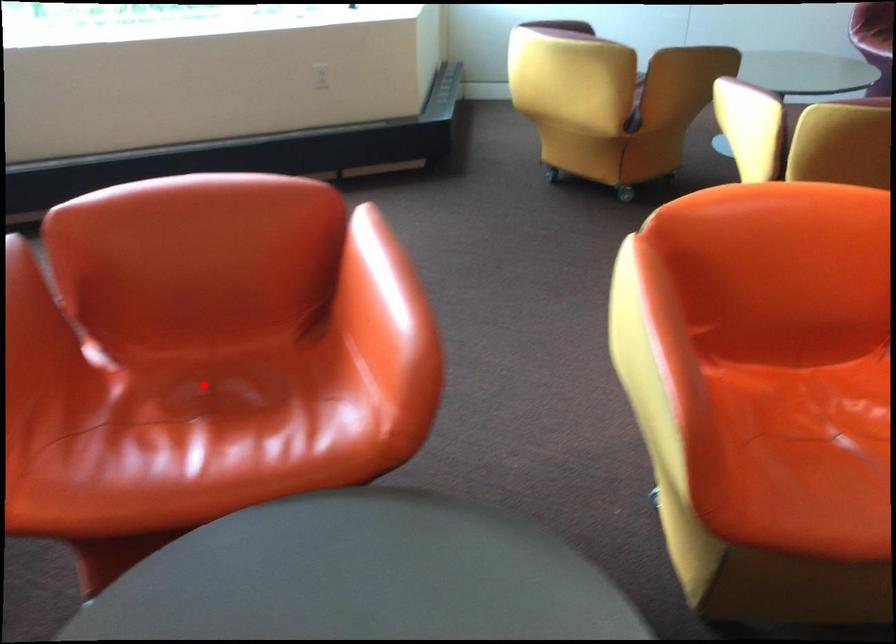
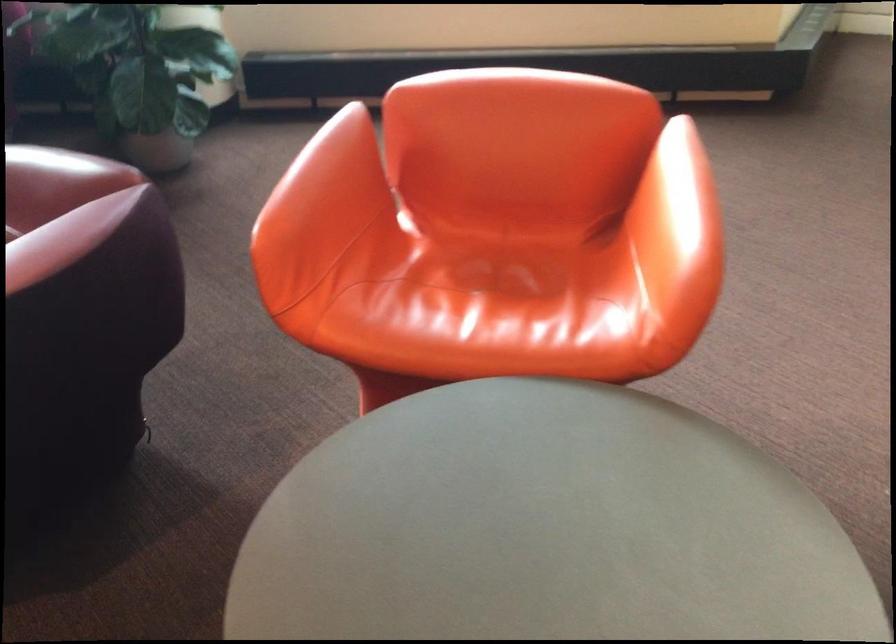
Where in the second image is the point corresponding to the highlighted location from the first image?

(487, 261)